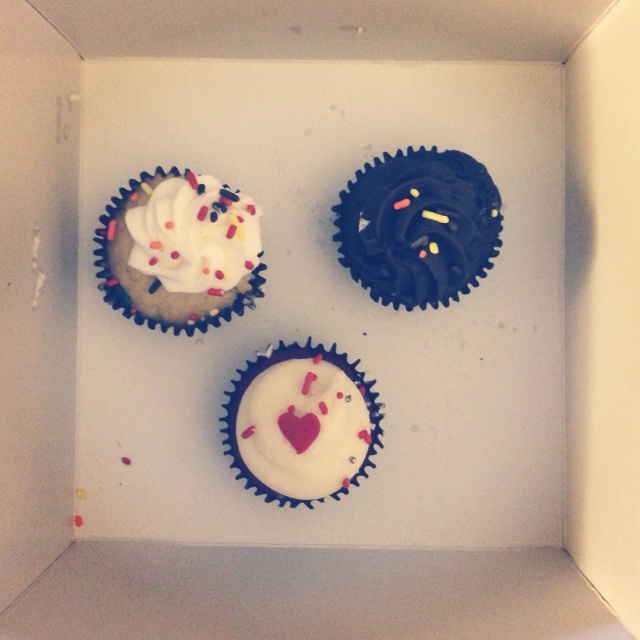
Does point (352, 225) come in front of point (301, 436)?

No, it is behind (301, 436).

This screenshot has width=640, height=640. I want to click on chocolate frosted cupcake at upper right, so click(x=419, y=227).

Locate an element on the screen. The width and height of the screenshot is (640, 640). chocolate frosted cupcake at upper right is located at coordinates (419, 227).

Does white matte cupcake at upper left have a lesser width compared to chocolate frosted cupcake at upper right?

No.

Does white matte cupcake at upper left have a lesser height compared to chocolate frosted cupcake at upper right?

No, white matte cupcake at upper left is not shorter than chocolate frosted cupcake at upper right.

Is point (195, 227) closer to camera compared to point (424, 241)?

Yes, it is in front of point (424, 241).

The height and width of the screenshot is (640, 640). What are the coordinates of `white matte cupcake at upper left` in the screenshot? It's located at (179, 252).

Between white matte cupcake at upper left and white matte cupcake at center, which one has more height?

white matte cupcake at center is taller.

Which is more to the right, white matte cupcake at upper left or white matte cupcake at center?

white matte cupcake at center

What do you see at coordinates (179, 252) in the screenshot? Image resolution: width=640 pixels, height=640 pixels. I see `white matte cupcake at upper left` at bounding box center [179, 252].

In order to click on white matte cupcake at upper left in this screenshot , I will do `click(179, 252)`.